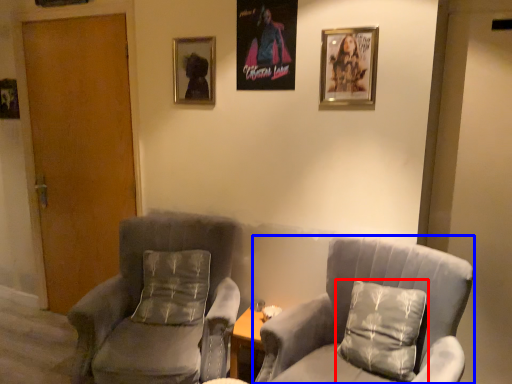
Question: Which object appears farthest to the camera in this image, pillow (highlighted by a red box) or chair (highlighted by a blue box)?

Choices:
 (A) pillow
 (B) chair

Answer: (A)